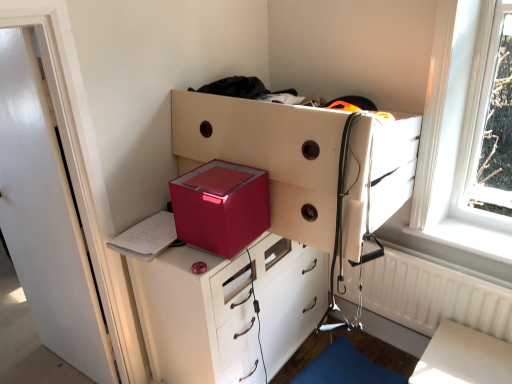
Identify the location of free location above white glossy table at lower right (from a real-world perspective). (463, 359).